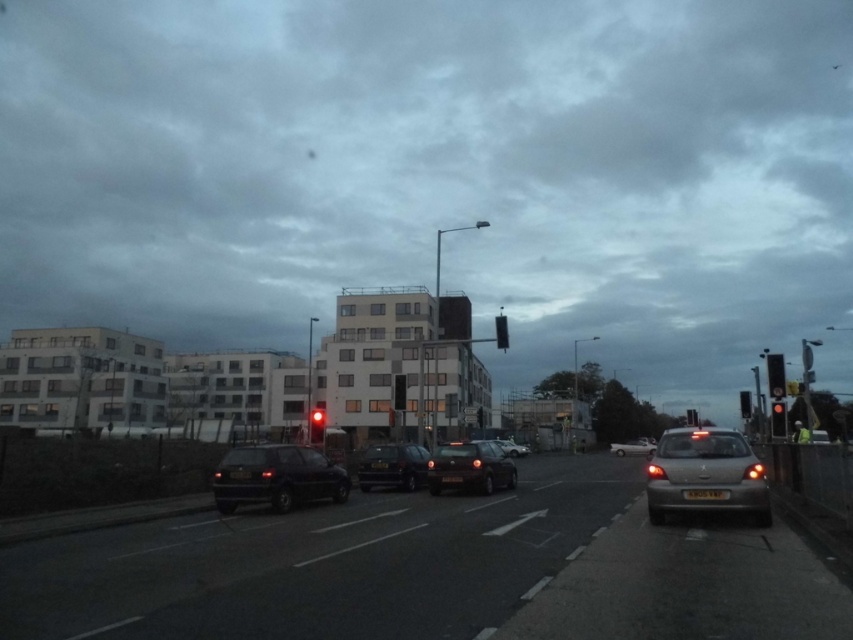
Question: In this image, where is matte black traffic light at center located relative to red plastic traffic light at center?

Choices:
 (A) below
 (B) above

Answer: (B)

Question: Among these points, which one is nearest to the camera?

Choices:
 (A) pos(486,449)
 (B) pos(781,406)
 (C) pos(770,362)

Answer: (C)

Question: Which object appears farthest from the camera in this image?

Choices:
 (A) black plastic traffic light at center
 (B) black plastic traffic light at right
 (C) matte black car at center

Answer: (A)

Question: Can you confirm if silver metallic car at right is bigger than red matte traffic light at center?

Choices:
 (A) yes
 (B) no

Answer: (A)

Question: Does shiny dark gray car at center lie in front of white glossy sedan at center?

Choices:
 (A) no
 (B) yes

Answer: (B)

Question: Estimate the real-world distances between objects in this image. Which object is farther from the matte black sedan at center?

Choices:
 (A) white glossy sedan at center
 (B) matte black car at lower left
 (C) shiny dark gray car at center

Answer: (B)